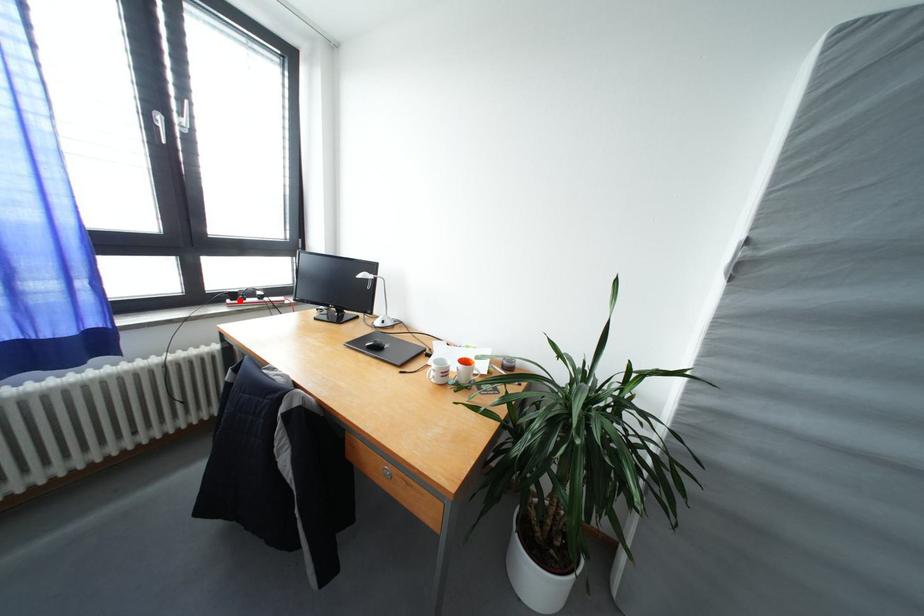
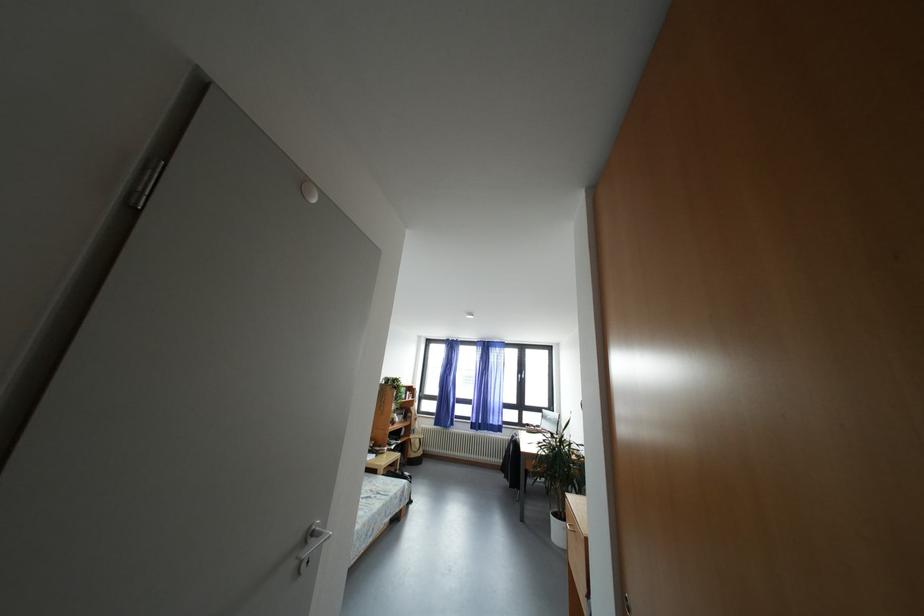
Question: I am providing you with two images of the same scene from different viewpoints. Given a red point in image1, look at the same physical point in image2. Is it:

Choices:
 (A) Closer to the viewpoint
 (B) Farther from the viewpoint

Answer: (B)